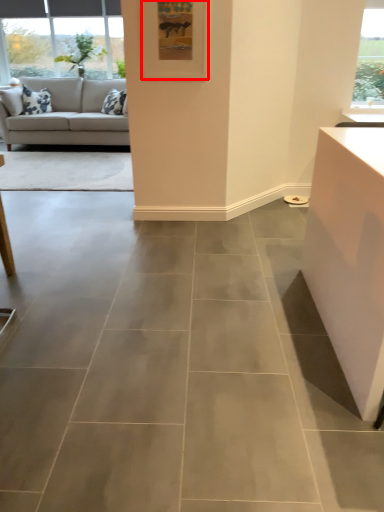
Question: From the image's perspective, where is picture frame (annotated by the red box) located in relation to studio couch in the image?

Choices:
 (A) below
 (B) above

Answer: (A)